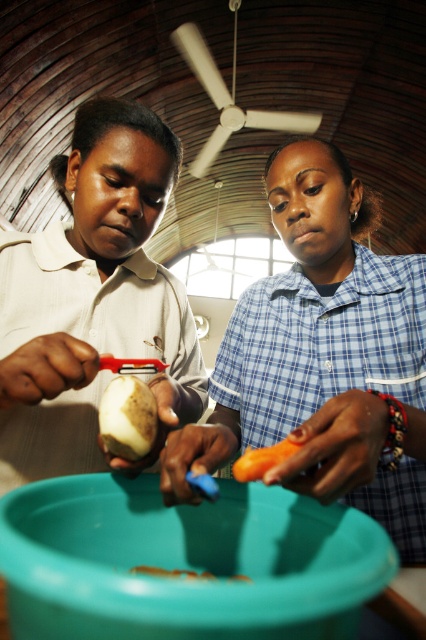
You are a chef observing the two people in the kitchen. You need to hand a knife to the person wearing the matte blue shirt at center. Since both are facing the smooth white potato at center, which direction should you approach from to avoid blocking their view?

Since the matte blue shirt at center is in front of the smooth white potato at center, you should approach from behind the matte blue shirt at center to avoid blocking their view of the smooth white potato at center.

You are organizing vegetables in a rustic kitchen. You have a matte white potato at left and an orange smooth carrot at lower center. Which vegetable is taller?

The matte white potato at left is taller than the orange smooth carrot at lower center according to the description.

You are a chef observing the scene. You need to quickly assess the position of the matte blue shirt at center and the orange smooth carrot at center. Which object is closer to you?

The matte blue shirt at center is closer to you because it is in front of the orange smooth carrot at center.